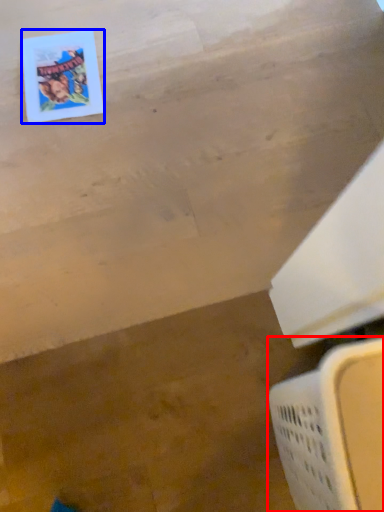
Question: Which of the following is the closest to the observer, laundry basket (highlighted by a red box) or comic book (highlighted by a blue box)?

Choices:
 (A) laundry basket
 (B) comic book

Answer: (A)